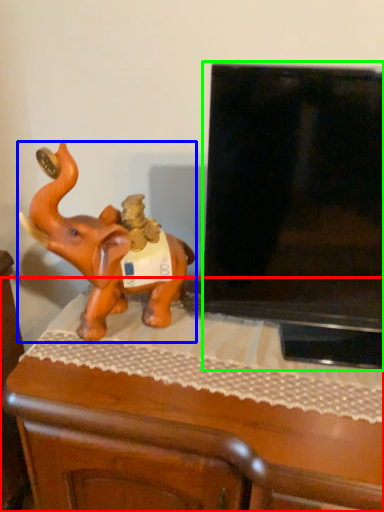
Question: Which object is the farthest from furniture (highlighted by a red box)? Choose among these: elephant (highlighted by a blue box) or television (highlighted by a green box).

Choices:
 (A) elephant
 (B) television

Answer: (B)